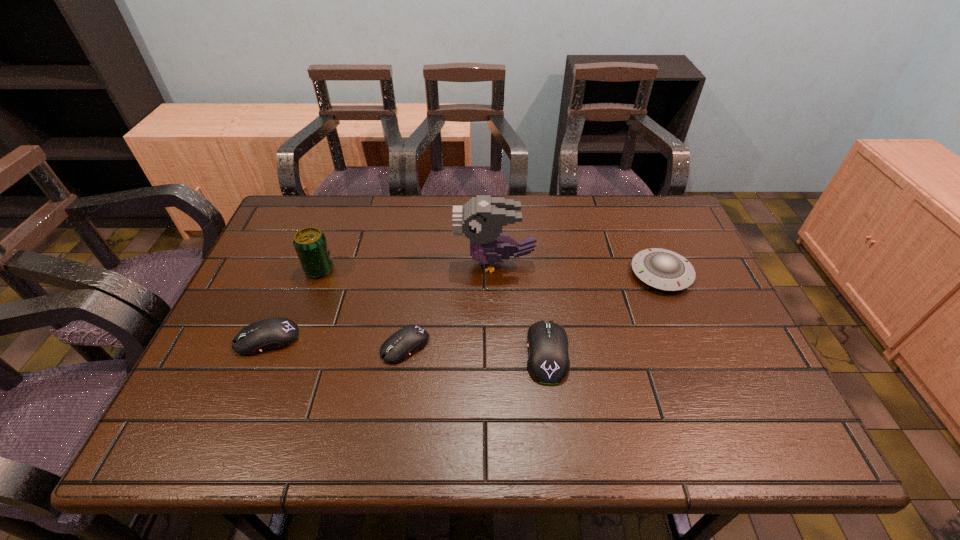
In the image, there is a desktop. Where is `vacant space at the near edge`? This screenshot has height=540, width=960. vacant space at the near edge is located at coordinates [x=472, y=380].

The height and width of the screenshot is (540, 960). Identify the location of vacant area at the right edge. (695, 287).

This screenshot has width=960, height=540. Identify the location of free space at the far left corner of the desktop. (299, 213).

Identify the location of vacant space at the far right corner of the desktop. (653, 199).

I want to click on free spot between the leftmost computer equipment and the saucer, so click(464, 307).

Find the location of a particular element. The image size is (960, 540). vacant space in between the rightmost computer equipment and the tallest object is located at coordinates (521, 308).

In order to click on vacant area that lies between the rightmost object and the rightmost computer equipment in this screenshot , I will do `click(604, 313)`.

Locate an element on the screen. free space between the bird and the shortest object is located at coordinates (450, 305).

Where is `free space between the rightmost computer equipment and the shortest object`? This screenshot has width=960, height=540. free space between the rightmost computer equipment and the shortest object is located at coordinates (476, 349).

The width and height of the screenshot is (960, 540). I want to click on free space between the rightmost object and the second tallest computer equipment, so click(464, 307).